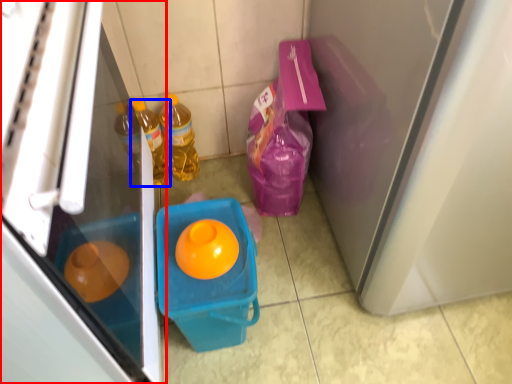
Question: Which point is further to the camera, refrigerator (highlighted by a red box) or bottle (highlighted by a blue box)?

Choices:
 (A) refrigerator
 (B) bottle

Answer: (B)